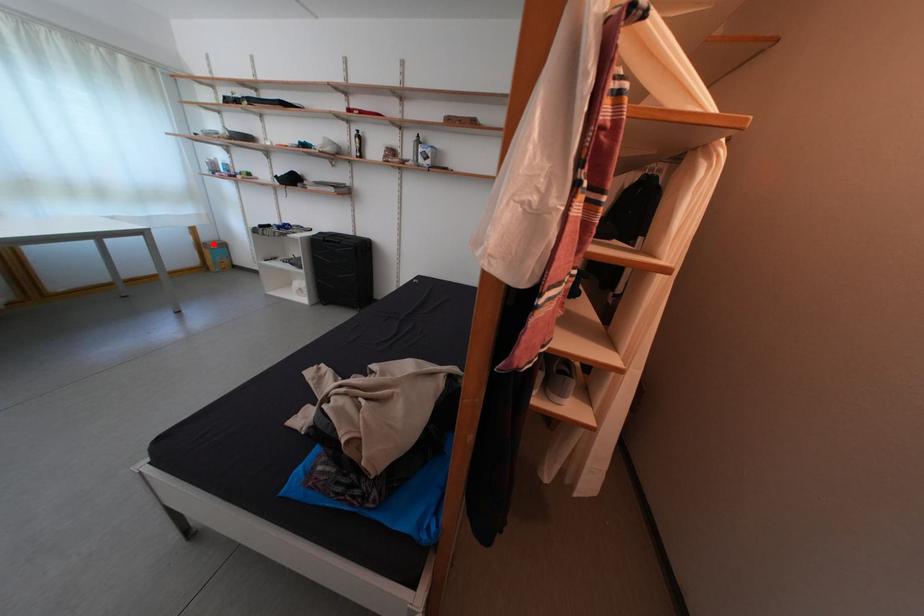
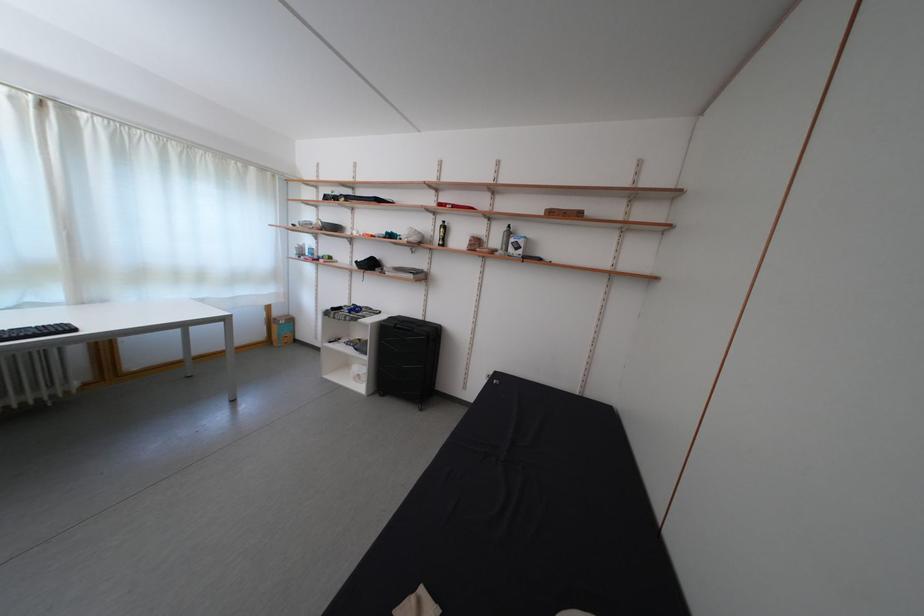
Where in the second image is the point corresponding to the highlighted location from the first image?

(285, 320)